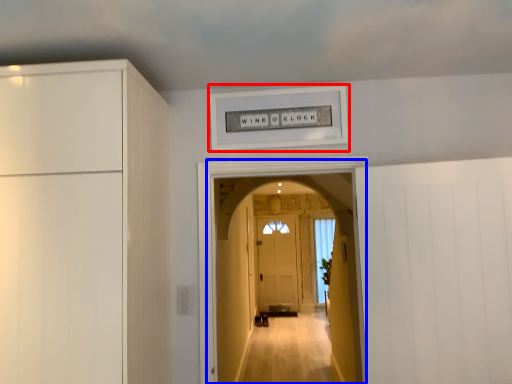
Question: Among these objects, which one is farthest to the camera, picture frame (highlighted by a red box) or corridor (highlighted by a blue box)?

Choices:
 (A) picture frame
 (B) corridor

Answer: (A)